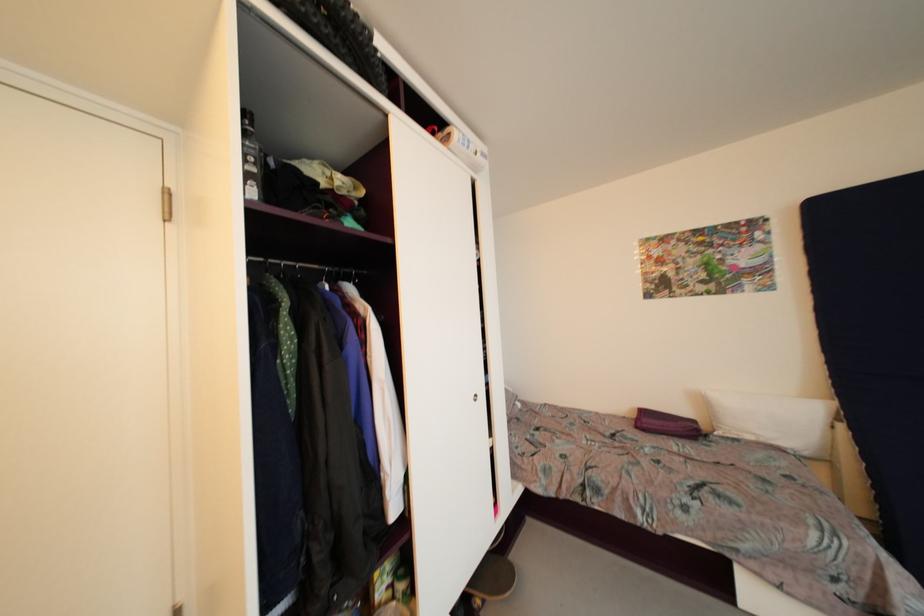
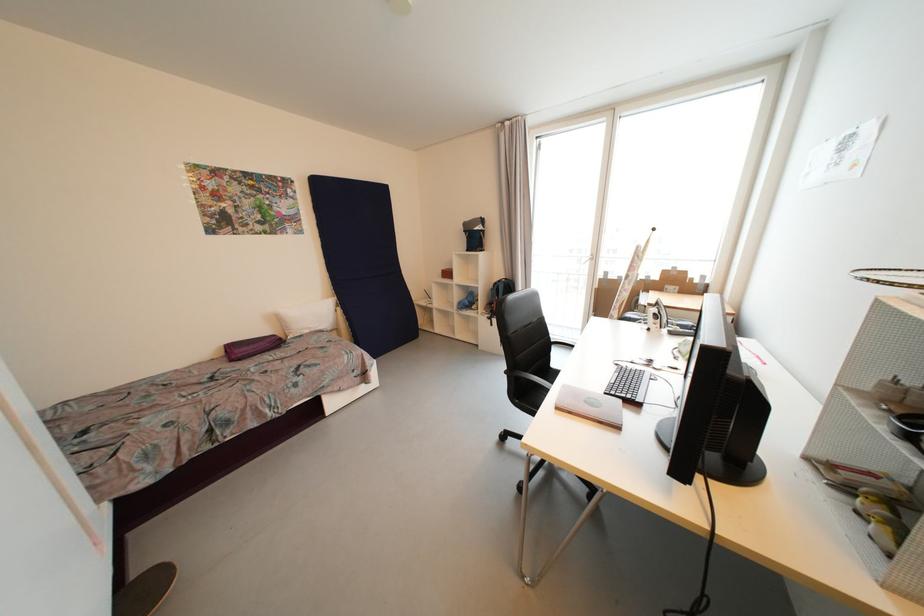
The point at (x=709, y=403) is marked in the first image. Where is the corresponding point in the second image?

(283, 321)